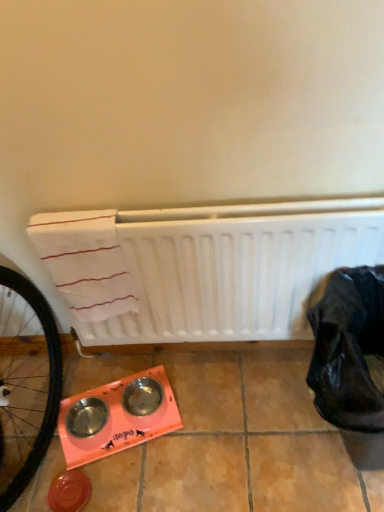
Locate an element on the screen. The width and height of the screenshot is (384, 512). vacant location below black fabric bag at lower right (from a real-world perspective) is located at coordinates (333, 453).